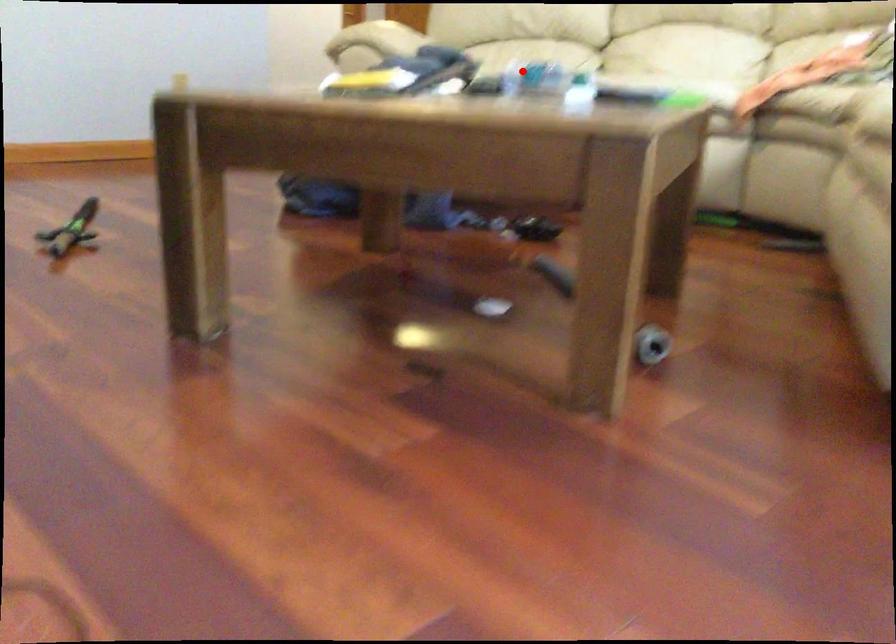
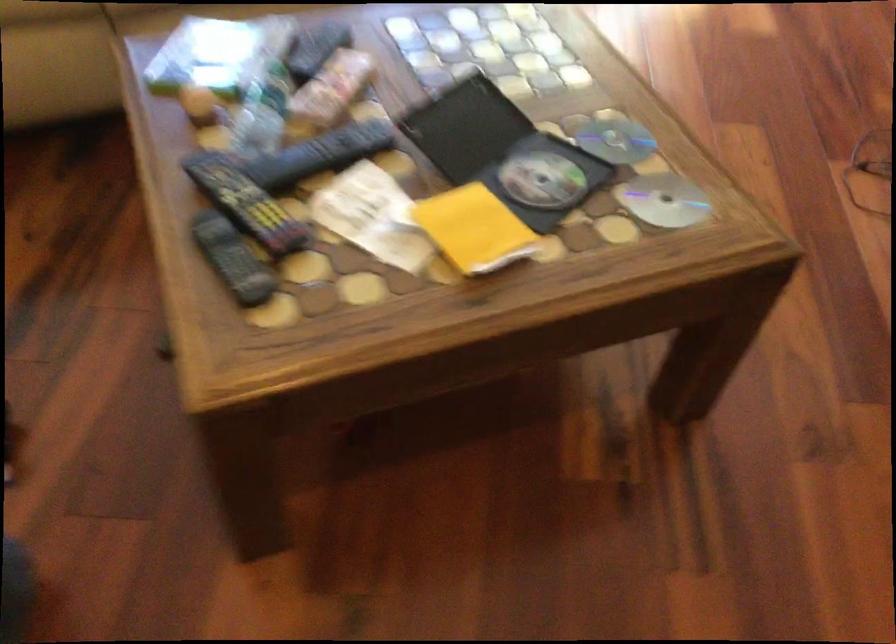
In the second image, find the point that corresponds to the highlighted location in the first image.

(262, 113)